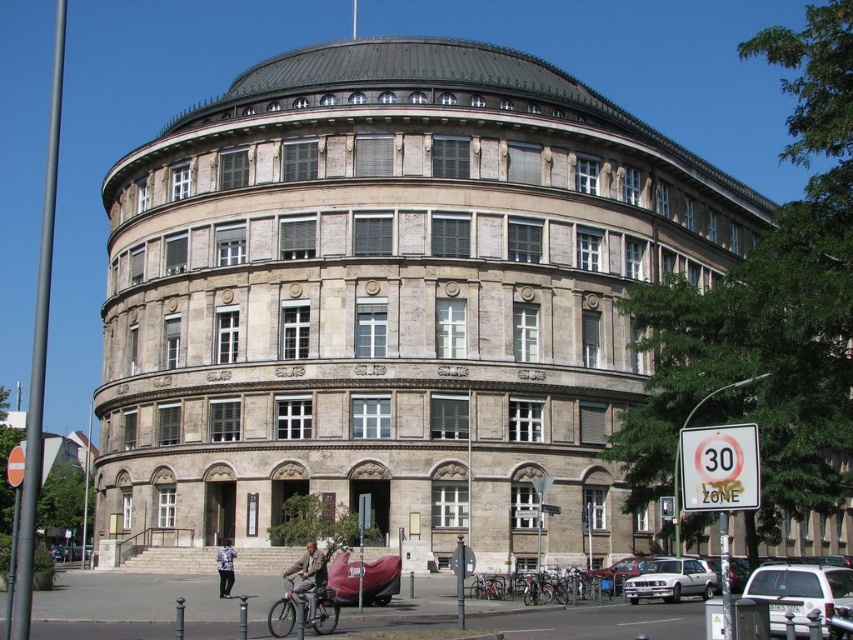
Does point (778, 609) come behind point (218, 560)?

No.

This screenshot has height=640, width=853. What do you see at coordinates (799, 593) in the screenshot?
I see `white plastic car at lower right` at bounding box center [799, 593].

The image size is (853, 640). I want to click on white plastic car at lower right, so click(x=799, y=593).

Which is behind, point (306, 556) or point (222, 552)?

The point (222, 552) is behind.

Identify the location of light brown leather jacket at center. (308, 577).

Find the location of a particular element. light brown leather jacket at center is located at coordinates (308, 577).

This screenshot has width=853, height=640. In order to click on light brown leather jacket at center in this screenshot , I will do `click(308, 577)`.

How far apart are silver metallic hatchback at lower right and denim jacket at lower center?

silver metallic hatchback at lower right is 15.35 meters away from denim jacket at lower center.

Who is positioned more to the right, silver metallic hatchback at lower right or denim jacket at lower center?

From the viewer's perspective, silver metallic hatchback at lower right appears more on the right side.

Is point (689, 561) positioned in front of point (228, 584)?

That is False.

Locate an element on the screen. The image size is (853, 640). silver metallic hatchback at lower right is located at coordinates (670, 580).